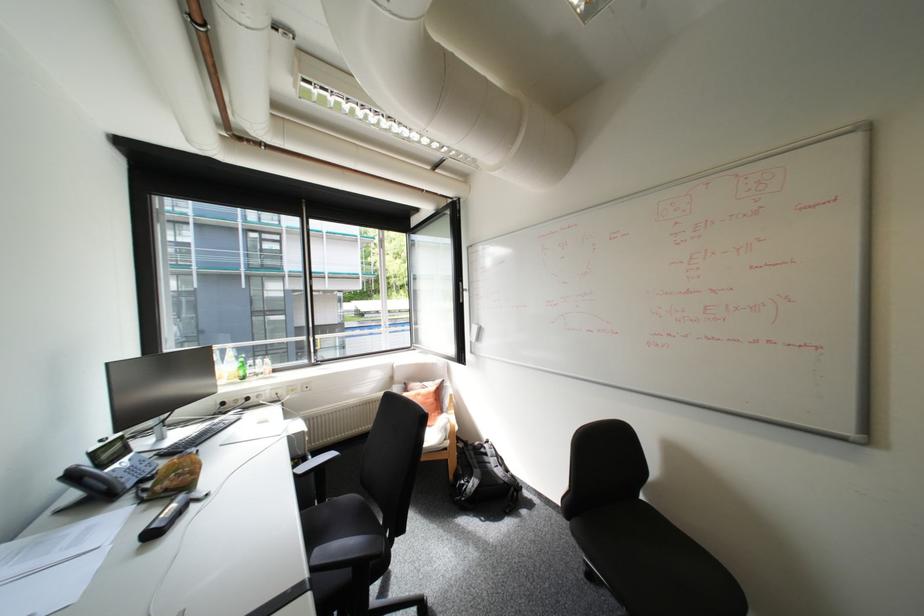
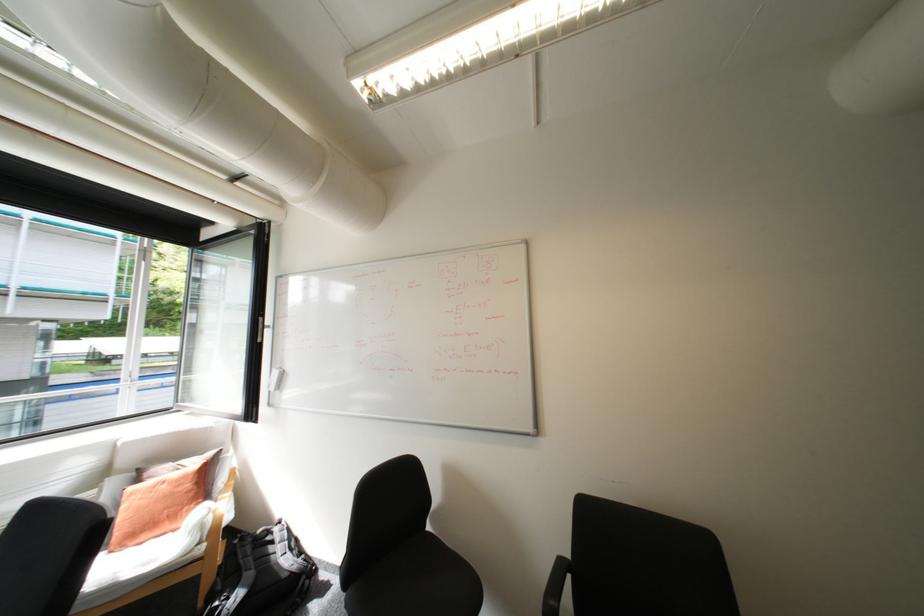
Where in the second image is the point corresponding to point (430, 397) from the first image?

(175, 485)